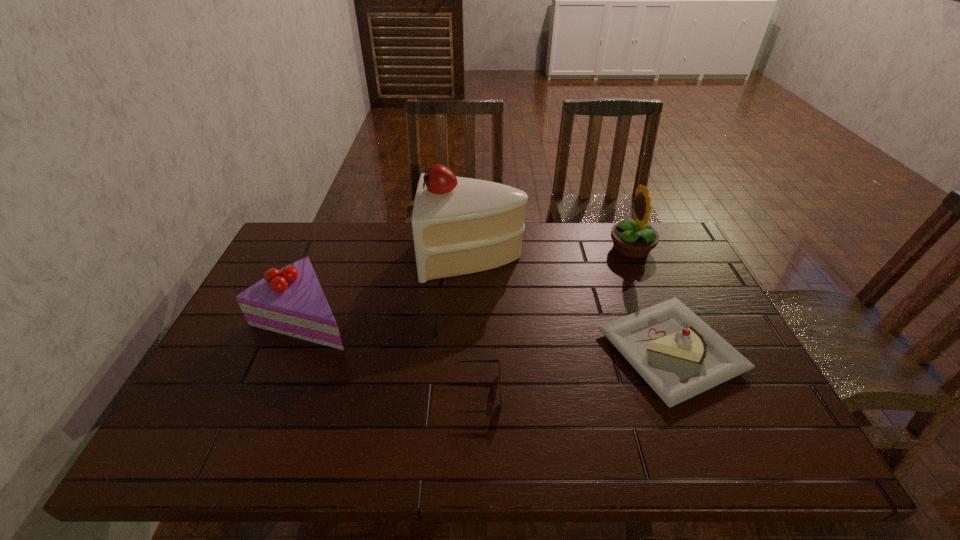
Locate an element on the screen. The width and height of the screenshot is (960, 540). cake that stands as the second closest to the third tallest object is located at coordinates (679, 356).

The image size is (960, 540). Identify the location of the second closest cake to the sunglasses. (290, 301).

At what (x,y) coordinates should I click in order to perform the action: click on vacant region that satisfies the following two spatial constraints: 1. on the face of the sunflower; 2. on the front side of the second cake from left to right. Please return your answer as a coordinate pair (x, y). This screenshot has width=960, height=540. Looking at the image, I should click on (635, 255).